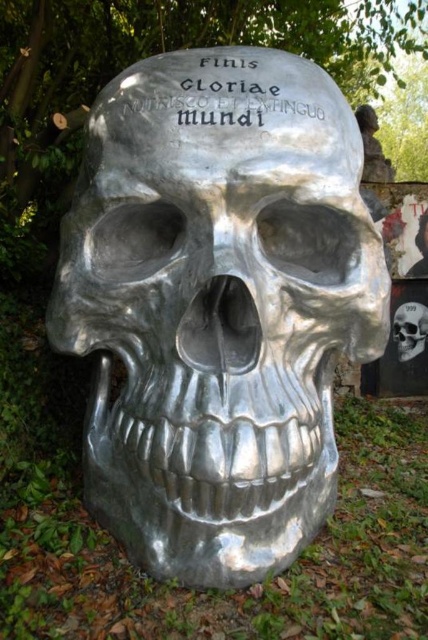
Can you confirm if shiny metallic skull at center is bigger than metallic silver skull at center?

Correct, shiny metallic skull at center is larger in size than metallic silver skull at center.

Is shiny metallic skull at center further to the viewer compared to metallic silver skull at center?

No, it is in front of metallic silver skull at center.

Which is behind, point (318, 358) or point (425, 220)?

The point (425, 220) is more distant.

Locate an element on the screen. This screenshot has width=428, height=640. shiny metallic skull at center is located at coordinates (217, 305).

Between shiny metallic skull at center and shiny silver skull at center, which one appears on the right side from the viewer's perspective?

shiny silver skull at center is more to the right.

Is shiny metallic skull at center shorter than shiny silver skull at center?

No.

What do you see at coordinates (217, 305) in the screenshot?
I see `shiny metallic skull at center` at bounding box center [217, 305].

At what (x,y) coordinates should I click in order to perform the action: click on shiny metallic skull at center. Please return your answer as a coordinate pair (x, y). Looking at the image, I should click on (217, 305).

Is shiny silver skull at center positioned behind metallic silver skull at center?

Yes, it is.

Looking at this image, is shiny silver skull at center shorter than metallic silver skull at center?

Yes.

Who is more distant from viewer, (413, 336) or (425, 259)?

Positioned behind is point (413, 336).

This screenshot has width=428, height=640. In order to click on shiny silver skull at center in this screenshot , I will do `click(410, 330)`.